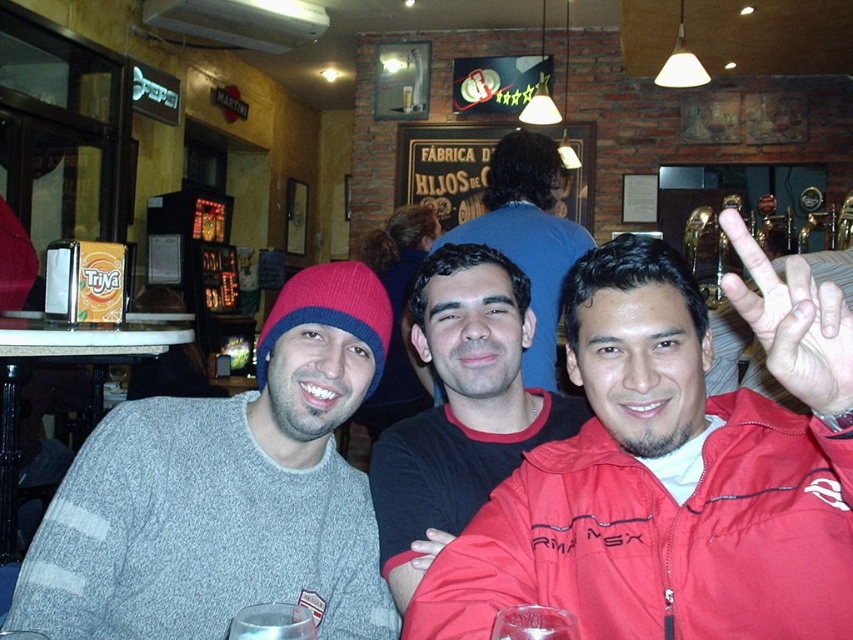
Can you confirm if red matte jacket at center is taller than matte black hand at center?

Indeed, red matte jacket at center has a greater height compared to matte black hand at center.

Does red matte jacket at center appear on the left side of matte black hand at center?

Incorrect, red matte jacket at center is not on the left side of matte black hand at center.

Is point (689, 554) positioned in front of point (434, 540)?

Yes, point (689, 554) is closer to viewer.

Image resolution: width=853 pixels, height=640 pixels. Find the location of `red matte jacket at center`. red matte jacket at center is located at coordinates (672, 468).

Does point (192, 472) come farther from viewer compared to point (784, 301)?

That is True.

Does gray knit beanie at upper left have a greater width compared to matte red hand at center right?

Indeed, gray knit beanie at upper left has a greater width compared to matte red hand at center right.

I want to click on gray knit beanie at upper left, so click(225, 492).

Who is shorter, red matte jacket at center or smooth black shirt at center?

With less height is red matte jacket at center.

Which is behind, point (752, 499) or point (496, 211)?

Point (496, 211)

The image size is (853, 640). Find the location of `red matte jacket at center`. red matte jacket at center is located at coordinates (672, 468).